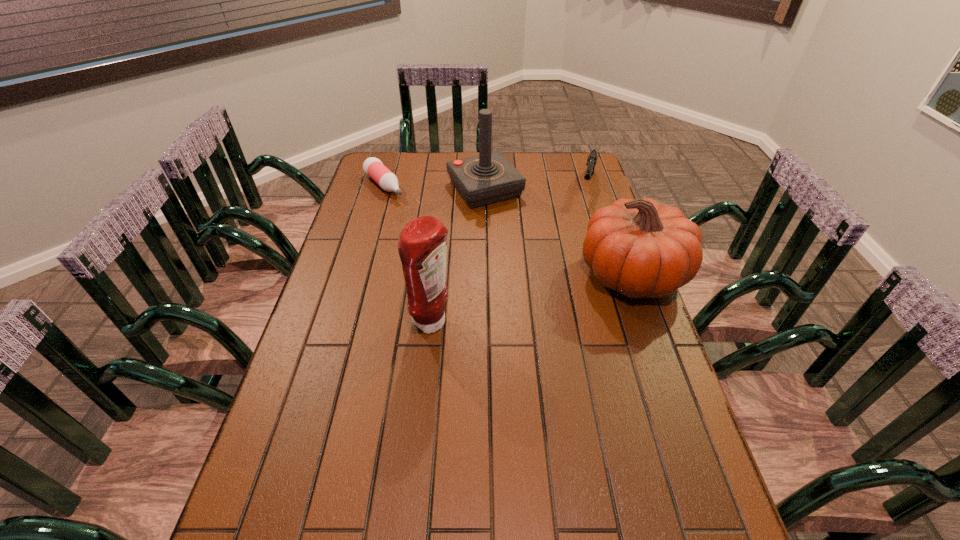
The image size is (960, 540). What are the coordinates of `pumpkin at the right edge` in the screenshot? It's located at (640, 248).

You are a GUI agent. You are given a task and a screenshot of the screen. Output one action in this format:
    pyautogui.click(x=<x>, y=<y>)
    Task: Click on the gun situated at the right edge
    The height and width of the screenshot is (540, 960).
    Given the screenshot: What is the action you would take?
    pyautogui.click(x=592, y=158)

Locate an element on the screen. The width and height of the screenshot is (960, 540). object located at the far left corner is located at coordinates (373, 167).

I want to click on object positioned at the far right corner, so click(592, 158).

Image resolution: width=960 pixels, height=540 pixels. I want to click on vacant space at the far edge of the desktop, so click(529, 181).

Locate an element on the screen. This screenshot has width=960, height=540. free space at the near edge of the desktop is located at coordinates (371, 477).

Where is `vacant point at the left edge`? The height and width of the screenshot is (540, 960). vacant point at the left edge is located at coordinates (305, 340).

Where is `free space at the right edge of the desktop`? free space at the right edge of the desktop is located at coordinates (588, 290).

This screenshot has height=540, width=960. Find the location of `vacant space at the far left corner of the desktop`. vacant space at the far left corner of the desktop is located at coordinates (383, 155).

Locate an element on the screen. vacant space at the far right corner of the desktop is located at coordinates (579, 164).